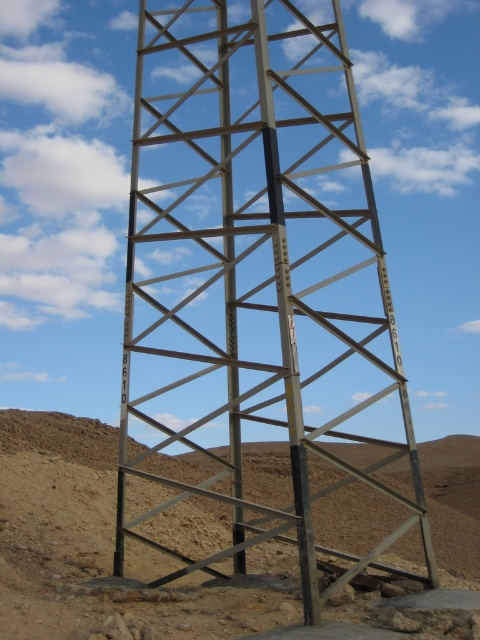
Between metallic structure at center and brown sandy soil at center, which one is positioned lower?

Positioned lower is brown sandy soil at center.

In the scene shown: Can you confirm if metallic structure at center is taller than brown sandy soil at center?

Yes.

Measure the distance between metallic structure at center and camera.

metallic structure at center and camera are 9.95 meters apart.

This screenshot has width=480, height=640. Find the location of `metallic structure at center`. metallic structure at center is located at coordinates (250, 257).